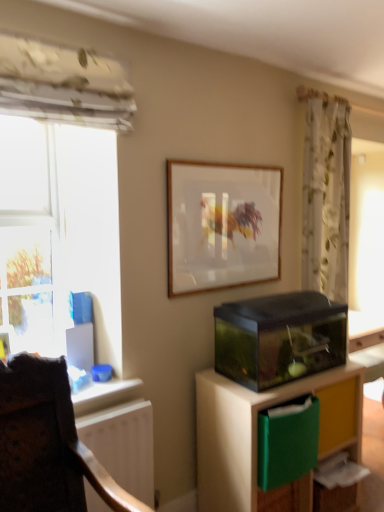
Identify the location of floral fabric curtain at upper right. (326, 194).

Where is `white matte radiator at lower left`? This screenshot has width=384, height=512. white matte radiator at lower left is located at coordinates click(123, 445).

Identify the location of wooden frame at upper center. (222, 225).

What do you see at coordinates (257, 430) in the screenshot?
I see `transparent glass aquarium at lower right` at bounding box center [257, 430].

The image size is (384, 512). What are the coordinates of `floral fabric curtain at upper right` in the screenshot? It's located at (326, 194).

From the image's perspective, which is above, transparent glass window at left or wooden frame at upper center?

From the image's view, wooden frame at upper center is above.

Is transparent glass window at left shorter than wooden frame at upper center?

In fact, transparent glass window at left may be taller than wooden frame at upper center.

Which is in front, point (5, 237) or point (250, 282)?

Positioned in front is point (5, 237).

Measure the distance from transparent glass window at left to wooden frame at upper center.

The distance of transparent glass window at left from wooden frame at upper center is 30.05 inches.

Based on the photo, between wooden frame at upper center and floral fabric curtain at upper right, which one is positioned in front?

Result: wooden frame at upper center is closer to the camera.

In the scene shown: Is wooden frame at upper center at the right side of floral fabric curtain at upper right?

Incorrect, wooden frame at upper center is not on the right side of floral fabric curtain at upper right.

Looking at this image, from a real-world perspective, is wooden frame at upper center above or below floral fabric curtain at upper right?

wooden frame at upper center is situated higher than floral fabric curtain at upper right in the real world.

Can you tell me how much wooden frame at upper center and floral fabric curtain at upper right differ in facing direction?

0.0067 degrees separate the facing orientations of wooden frame at upper center and floral fabric curtain at upper right.

Consider the image. From a real-world perspective, is white matte radiator at lower left physically above velvet dark brown chair at lower left?

Incorrect, from a real-world perspective, white matte radiator at lower left is lower than velvet dark brown chair at lower left.

Looking at this image, is white matte radiator at lower left wider or thinner than velvet dark brown chair at lower left?

Clearly, white matte radiator at lower left has less width compared to velvet dark brown chair at lower left.

Based on their positions, is white matte radiator at lower left located to the left or right of velvet dark brown chair at lower left?

In the image, white matte radiator at lower left appears on the right side of velvet dark brown chair at lower left.

Looking at this image, is white matte radiator at lower left aimed at velvet dark brown chair at lower left?

No, white matte radiator at lower left is not facing towards velvet dark brown chair at lower left.

Where is `cabinetry in front of the floral fabric curtain at upper right`? Image resolution: width=384 pixels, height=512 pixels. cabinetry in front of the floral fabric curtain at upper right is located at coordinates (257, 430).

From a real-world perspective, is floral fabric curtain at upper right located higher than transparent glass aquarium at lower right?

Yes.

Which object is wider, floral fabric curtain at upper right or transparent glass aquarium at lower right?

transparent glass aquarium at lower right.

Is the depth of floral fabric curtain at upper right greater than that of transparent glass aquarium at lower right?

Yes, floral fabric curtain at upper right is behind transparent glass aquarium at lower right.

Considering the sizes of objects transparent glass window at left and transparent glass aquarium at lower right in the image provided, who is bigger, transparent glass window at left or transparent glass aquarium at lower right?

Bigger between the two is transparent glass aquarium at lower right.

Is transparent glass window at left taller or shorter than transparent glass aquarium at lower right?

Clearly, transparent glass window at left is taller compared to transparent glass aquarium at lower right.

From the image's perspective, does transparent glass window at left appear lower than transparent glass aquarium at lower right?

Incorrect, from the image's perspective, transparent glass window at left is higher than transparent glass aquarium at lower right.

From a real-world perspective, relative to transparent glass aquarium at lower right, is wooden frame at upper center vertically above or below?

In terms of real-world spatial position, wooden frame at upper center is above transparent glass aquarium at lower right.

Is wooden frame at upper center facing away from transparent glass aquarium at lower right?

No, wooden frame at upper center is not facing the opposite direction of transparent glass aquarium at lower right.

Considering the relative sizes of wooden frame at upper center and transparent glass aquarium at lower right in the image provided, is wooden frame at upper center thinner than transparent glass aquarium at lower right?

Indeed, wooden frame at upper center has a lesser width compared to transparent glass aquarium at lower right.

From the image's perspective, would you say white matte radiator at lower left is positioned over floral fabric curtain at upper right?

No, from the image's perspective, white matte radiator at lower left is not on top of floral fabric curtain at upper right.

Where is `curtain behind the white matte radiator at lower left`? The height and width of the screenshot is (512, 384). curtain behind the white matte radiator at lower left is located at coordinates (326, 194).

Considering the relative positions of white matte radiator at lower left and floral fabric curtain at upper right in the image provided, is white matte radiator at lower left to the right of floral fabric curtain at upper right from the viewer's perspective?

In fact, white matte radiator at lower left is to the left of floral fabric curtain at upper right.

Where is `window located behind the wooden frame at upper center`? This screenshot has height=512, width=384. window located behind the wooden frame at upper center is located at coordinates (30, 237).

Where is `picture frame in front of the floral fabric curtain at upper right`? Image resolution: width=384 pixels, height=512 pixels. picture frame in front of the floral fabric curtain at upper right is located at coordinates (222, 225).

Based on their spatial positions, is floral fabric curtain at upper right or transparent glass window at left further from wooden frame at upper center?

transparent glass window at left is positioned further to the anchor wooden frame at upper center.

Based on their spatial positions, is white matte radiator at lower left or velvet dark brown chair at lower left closer to transparent glass aquarium at lower right?

white matte radiator at lower left is closer to transparent glass aquarium at lower right.

Estimate the real-world distances between objects in this image. Which object is closer to transparent glass aquarium at lower right, white matte radiator at lower left or transparent glass aquarium at lower right?

The object closer to transparent glass aquarium at lower right is transparent glass aquarium at lower right.

Looking at the image, which one is located further to velvet dark brown chair at lower left, white matte radiator at lower left or transparent glass aquarium at lower right?

The object further to velvet dark brown chair at lower left is transparent glass aquarium at lower right.

Which object lies further to the anchor point wooden frame at upper center, transparent glass window at left or velvet dark brown chair at lower left?

Among the two, velvet dark brown chair at lower left is located further to wooden frame at upper center.

From the image, which object appears to be farther from velvet dark brown chair at lower left, white matte radiator at lower left or transparent glass window at left?

transparent glass window at left is further to velvet dark brown chair at lower left.

Considering their positions, is velvet dark brown chair at lower left positioned closer to white matte radiator at lower left than transparent glass aquarium at lower right?

Among the two, velvet dark brown chair at lower left is located nearer to white matte radiator at lower left.

When comparing their distances from transparent glass aquarium at lower right, does velvet dark brown chair at lower left or wooden frame at upper center seem further?

wooden frame at upper center is positioned further to the anchor transparent glass aquarium at lower right.

Find the location of a particular element. The image size is (384, 512). appliance between wooden frame at upper center and floral fabric curtain at upper right is located at coordinates (279, 338).

This screenshot has height=512, width=384. I want to click on chair between transparent glass window at left and transparent glass aquarium at lower right, so click(47, 444).

You are a GUI agent. You are given a task and a screenshot of the screen. Output one action in this format:
    pyautogui.click(x=<x>, y=<y>)
    Task: Click on the cabinetry located between transparent glass window at left and floral fabric curtain at upper right in the left-right direction
    
    Given the screenshot: What is the action you would take?
    pyautogui.click(x=257, y=430)

This screenshot has height=512, width=384. I want to click on radiator located between velvet dark brown chair at lower left and transparent glass aquarium at lower right in the depth direction, so click(x=123, y=445).